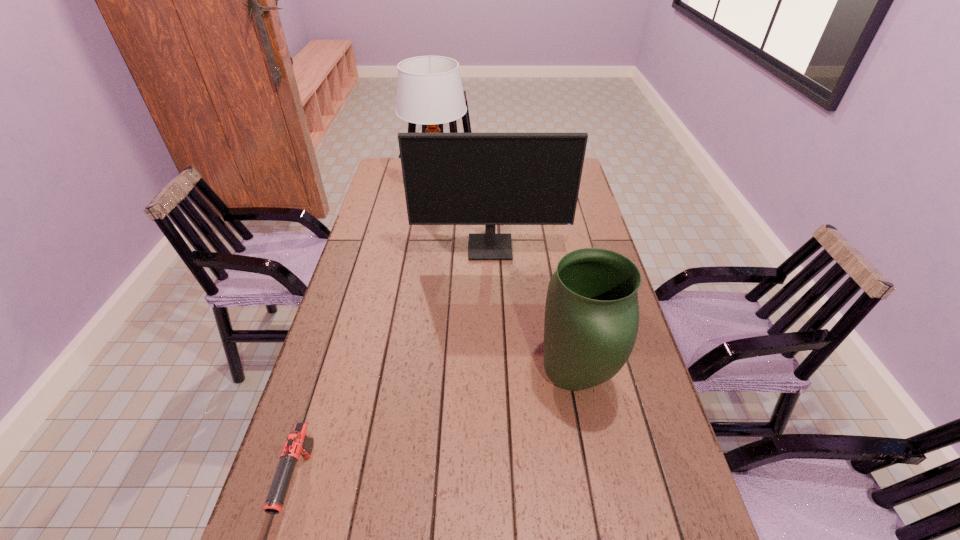
This screenshot has width=960, height=540. I want to click on the farthest object, so click(x=429, y=90).

At what (x,y) coordinates should I click in order to perform the action: click on computer monitor. Please return your answer as a coordinate pair (x, y). The width and height of the screenshot is (960, 540). Looking at the image, I should click on (490, 179).

I want to click on vase, so click(x=591, y=322).

Locate an element on the screen. This screenshot has height=540, width=960. the third tallest object is located at coordinates (591, 322).

At what (x,y) coordinates should I click in order to perform the action: click on the nearest object. Please return your answer as a coordinate pair (x, y). The height and width of the screenshot is (540, 960). Looking at the image, I should click on (298, 443).

Locate an element on the screen. The width and height of the screenshot is (960, 540). gun is located at coordinates (298, 443).

At what (x,y) coordinates should I click in order to perform the action: click on vacant space located on the back of the farthest object. Please return your answer as a coordinate pair (x, y). The width and height of the screenshot is (960, 540). Looking at the image, I should click on (441, 160).

Locate an element on the screen. This screenshot has width=960, height=540. vacant space located on the front-facing side of the third nearest object is located at coordinates (492, 293).

This screenshot has width=960, height=540. I want to click on vacant space located on the left of the vase, so click(x=447, y=378).

In order to click on object present at the far edge in this screenshot , I will do `click(429, 90)`.